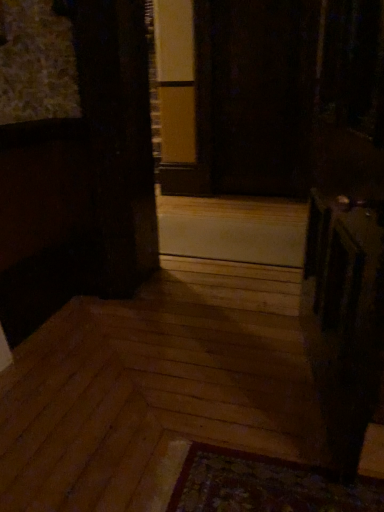
I want to click on free region under transparent glass screen door at center (from a real-world perspective), so click(x=249, y=194).